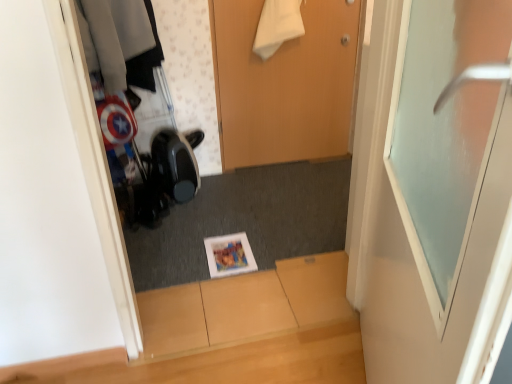
Question: Does wooden door at center, the second door when ordered from front to back, have a larger size compared to frosted glass door at upper right, which appears as the 2th door when viewed from the back?

Choices:
 (A) yes
 (B) no

Answer: (B)

Question: Is wooden door at center, the second door when ordered from front to back, at the right side of frosted glass door at upper right, the first door when ordered from front to back?

Choices:
 (A) yes
 (B) no

Answer: (B)

Question: Does wooden door at center, the second door when ordered from front to back, have a greater width compared to frosted glass door at upper right, the first door when ordered from front to back?

Choices:
 (A) yes
 (B) no

Answer: (B)

Question: Can you confirm if wooden door at center, the second door when ordered from front to back, is smaller than frosted glass door at upper right, which appears as the 2th door when viewed from the back?

Choices:
 (A) no
 (B) yes

Answer: (B)

Question: Is wooden door at center, which is the first door in back-to-front order, shorter than frosted glass door at upper right, the first door when ordered from front to back?

Choices:
 (A) no
 (B) yes

Answer: (B)

Question: Does point (244, 231) appear closer or farther from the camera than point (387, 365)?

Choices:
 (A) farther
 (B) closer

Answer: (A)

Question: Is matte paper magazine at center wider or thinner than frosted glass door at upper right, which appears as the 2th door when viewed from the back?

Choices:
 (A) thin
 (B) wide

Answer: (B)

Question: Is matte paper magazine at center in front of or behind frosted glass door at upper right, which appears as the 2th door when viewed from the back, in the image?

Choices:
 (A) behind
 (B) front

Answer: (A)

Question: Would you say matte paper magazine at center is to the left or to the right of frosted glass door at upper right, which appears as the 2th door when viewed from the back, in the picture?

Choices:
 (A) left
 (B) right

Answer: (A)

Question: Is wooden door at center, which is the first door in back-to-front order, to the left or to the right of matte paper magazine at center in the image?

Choices:
 (A) left
 (B) right

Answer: (B)

Question: From a real-world perspective, relative to matte paper magazine at center, is wooden door at center, the second door when ordered from front to back, vertically above or below?

Choices:
 (A) below
 (B) above

Answer: (B)

Question: Is wooden door at center, the second door when ordered from front to back, inside or outside of matte paper magazine at center?

Choices:
 (A) inside
 (B) outside

Answer: (B)

Question: From their relative heights in the image, would you say wooden door at center, which is the first door in back-to-front order, is taller or shorter than matte paper magazine at center?

Choices:
 (A) short
 (B) tall

Answer: (B)

Question: Considering the positions of wooden door at center, which is the first door in back-to-front order, and frosted glass door at upper right, the first door when ordered from front to back, in the image, is wooden door at center, which is the first door in back-to-front order, wider or thinner than frosted glass door at upper right, the first door when ordered from front to back,?

Choices:
 (A) thin
 (B) wide

Answer: (A)

Question: Is point (331, 87) closer or farther from the camera than point (404, 144)?

Choices:
 (A) farther
 (B) closer

Answer: (A)